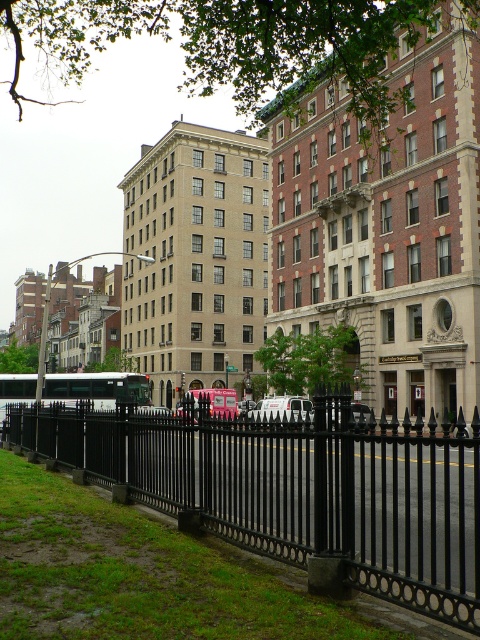
In the scene shown: You are a delivery driver who needs to park your truck behind the black wrought iron fence at lower left. Can you see the white matte van at center from your truck if you park there?

The black wrought iron fence at lower left is taller than the white matte van at center. Since the fence is taller, it would block the view of the van, so you cannot see the white matte van at center from your truck.

You are a pedestrian standing on the sidewalk and want to see the metallic silver bus at center. Is the black wrought iron fence at lower left blocking your view of the bus?

The black wrought iron fence at lower left is positioned over metallic silver bus at center, so the fence is blocking the view of the bus.

You are a delivery driver needing to park your van between the black wrought iron fence at lower left and the metallic silver bus at center. Can your van fit in the space between them?

The black wrought iron fence at lower left is wider than the metallic silver bus at center. Since the fence is wider, the space between them might be too narrow for your van to fit comfortably. You should check the exact measurements before attempting to park there.